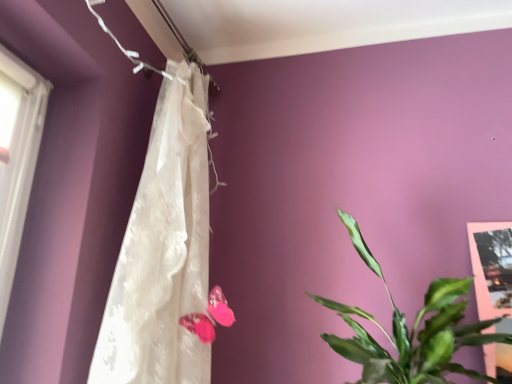
This screenshot has width=512, height=384. I want to click on green leafy plant at right, so click(x=411, y=331).

Image resolution: width=512 pixels, height=384 pixels. Identify the location of pink fabric butterfly at center. (219, 307).

Where is `curtain on the left of green leafy plant at right`? Image resolution: width=512 pixels, height=384 pixels. curtain on the left of green leafy plant at right is located at coordinates (163, 250).

Is green leafy plant at right facing away from white lace curtain at upper center?

No, green leafy plant at right is not facing the opposite direction of white lace curtain at upper center.

Can you confirm if green leafy plant at right is taller than white lace curtain at upper center?

In fact, green leafy plant at right may be shorter than white lace curtain at upper center.

Is green leafy plant at right closer to camera compared to white lace curtain at upper center?

Yes, green leafy plant at right is closer to the camera.

Measure the distance between pink fabric butterfly at center and green leafy plant at right.

13.86 inches.

Where is `flower lying on the left of green leafy plant at right`? The width and height of the screenshot is (512, 384). flower lying on the left of green leafy plant at right is located at coordinates (219, 307).

Is pink fabric butterfly at center touching green leafy plant at right?

No, pink fabric butterfly at center is not beside green leafy plant at right.

Would you say pink fabric butterfly at center is to the left or to the right of green leafy plant at right in the picture?

Based on their positions, pink fabric butterfly at center is located to the left of green leafy plant at right.

Image resolution: width=512 pixels, height=384 pixels. Identify the location of flower on the left of green leafy plant at right. (219, 307).

From a real-world perspective, between green leafy plant at right and pink fabric butterfly at center, who is vertically lower?

In real-world perspective, pink fabric butterfly at center is lower.

Based on their positions, is green leafy plant at right located to the left or right of pink fabric butterfly at center?

From the image, it's evident that green leafy plant at right is to the right of pink fabric butterfly at center.

In the scene shown: In terms of width, does green leafy plant at right look wider or thinner when compared to pink fabric butterfly at center?

Considering their sizes, green leafy plant at right looks broader than pink fabric butterfly at center.

Image resolution: width=512 pixels, height=384 pixels. Identify the location of curtain on the left of green leafy plant at right. (163, 250).

Considering the positions of point (208, 209) and point (360, 237), is point (208, 209) closer or farther from the camera than point (360, 237)?

Clearly, point (208, 209) is more distant from the camera than point (360, 237).

Who is more distant, white lace curtain at upper center or green leafy plant at right?

white lace curtain at upper center is further away from the camera.

Is white lace curtain at upper center looking in the opposite direction of green leafy plant at right?

No, white lace curtain at upper center is not facing the opposite direction of green leafy plant at right.

Visually, is pink fabric butterfly at center positioned to the left or to the right of white lace curtain at upper center?

In the image, pink fabric butterfly at center appears on the right side of white lace curtain at upper center.

Does pink fabric butterfly at center touch white lace curtain at upper center?

No, pink fabric butterfly at center is not making contact with white lace curtain at upper center.

Is pink fabric butterfly at center in front of or behind white lace curtain at upper center in the image?

pink fabric butterfly at center is behind white lace curtain at upper center.

Looking at their sizes, would you say pink fabric butterfly at center is wider or thinner than white lace curtain at upper center?

In the image, pink fabric butterfly at center appears to be more narrow than white lace curtain at upper center.

At what (x,y) coordinates should I click in order to perform the action: click on curtain positioned vertically above the pink fabric butterfly at center (from a real-world perspective). Please return your answer as a coordinate pair (x, y). Image resolution: width=512 pixels, height=384 pixels. Looking at the image, I should click on (163, 250).

Could you tell me if white lace curtain at upper center is facing pink fabric butterfly at center?

Yes.

Is pink fabric butterfly at center surrounded by white lace curtain at upper center?

Yes, pink fabric butterfly at center is a part of white lace curtain at upper center.

Visually, is white lace curtain at upper center positioned to the left or to the right of pink fabric butterfly at center?

white lace curtain at upper center is to the left of pink fabric butterfly at center.

Image resolution: width=512 pixels, height=384 pixels. I want to click on houseplant that appears below the white lace curtain at upper center (from the image's perspective), so tap(411, 331).

In the image, there is a pink fabric butterfly at center. At what (x,y) coordinates should I click in order to perform the action: click on houseplant above it (from the image's perspective). Please return your answer as a coordinate pair (x, y). This screenshot has width=512, height=384. Looking at the image, I should click on (411, 331).

Considering their positions, is pink fabric butterfly at center positioned closer to white lace curtain at upper center than green leafy plant at right?

The object closer to white lace curtain at upper center is pink fabric butterfly at center.

From the image, which object appears to be nearer to white lace curtain at upper center, green leafy plant at right or pink fabric butterfly at center?

pink fabric butterfly at center is closer to white lace curtain at upper center.

Estimate the real-world distances between objects in this image. Which object is closer to green leafy plant at right, pink fabric butterfly at center or white lace curtain at upper center?

pink fabric butterfly at center lies closer to green leafy plant at right than the other object.

When comparing their distances from pink fabric butterfly at center, does green leafy plant at right or white lace curtain at upper center seem closer?

Based on the image, white lace curtain at upper center appears to be nearer to pink fabric butterfly at center.

Which object lies nearer to the anchor point green leafy plant at right, white lace curtain at upper center or pink fabric butterfly at center?

pink fabric butterfly at center is closer to green leafy plant at right.

Estimate the real-world distances between objects in this image. Which object is further from pink fabric butterfly at center, white lace curtain at upper center or green leafy plant at right?

green leafy plant at right is positioned further to the anchor pink fabric butterfly at center.

Image resolution: width=512 pixels, height=384 pixels. Find the location of `flower between white lace curtain at upper center and green leafy plant at right in the horizontal direction`. flower between white lace curtain at upper center and green leafy plant at right in the horizontal direction is located at coordinates (219, 307).